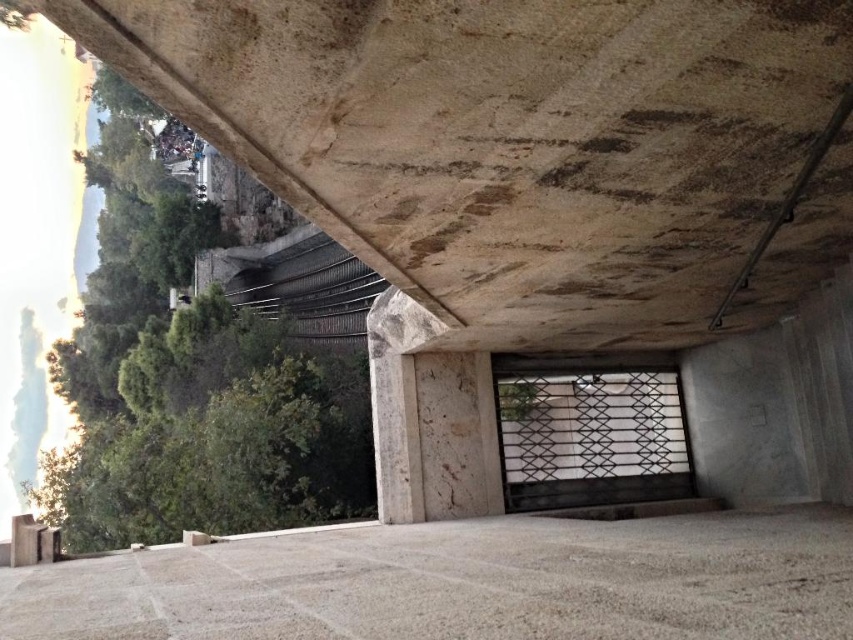
Who is positioned more to the right, rustic stone overpass at upper center or gray stone floor at center?

rustic stone overpass at upper center

Consider the image. Who is more forward, (369, 145) or (451, 625)?

Point (451, 625)

Where is `rustic stone overpass at upper center`? This screenshot has height=640, width=853. rustic stone overpass at upper center is located at coordinates (527, 147).